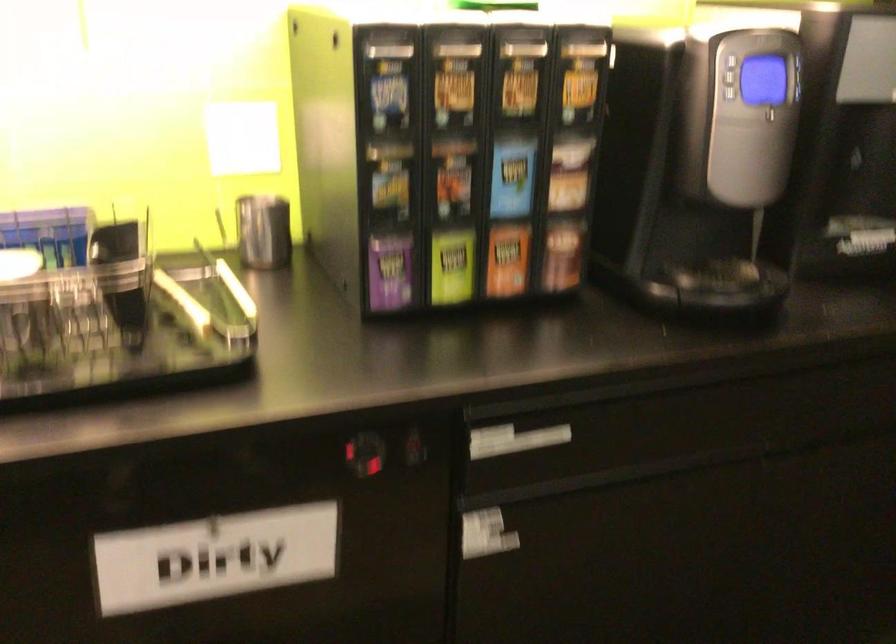
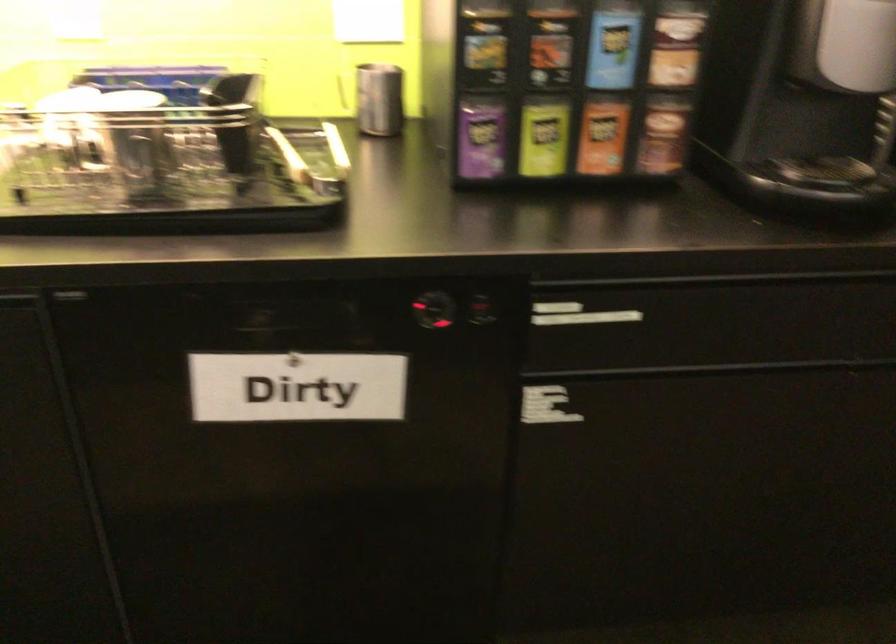
In the second image, find the point that corresponds to pixel 364 458 in the first image.

(433, 310)